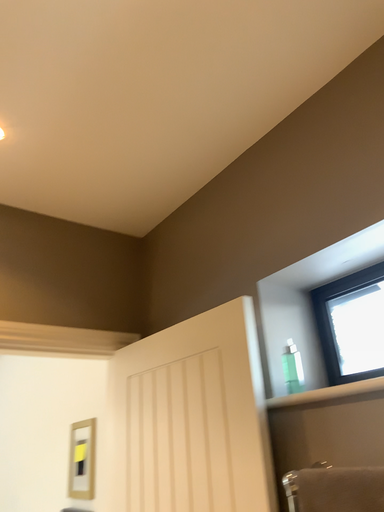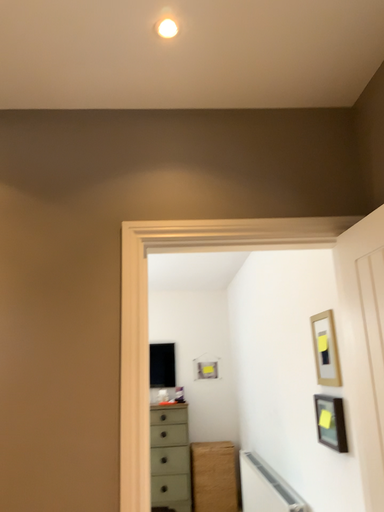
Question: How did the camera likely rotate when shooting the video?

Choices:
 (A) rotated downward
 (B) rotated upward

Answer: (A)